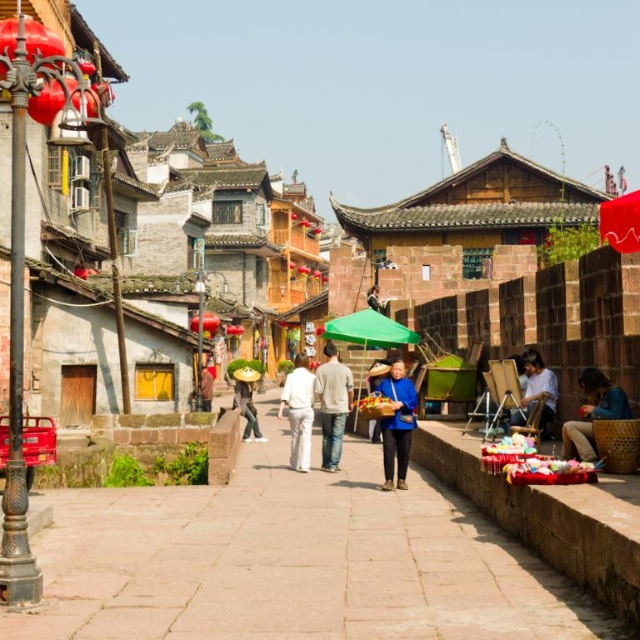
You are a tourist walking on the paved stone walkway at center and you see a brown leather jacket at center. Which object is longer?

The brown leather jacket at center is longer than the paved stone walkway at center.

You are a traveler walking down the street and see the green straw hat at center and the dark blue fabric at center. Which item is located to the left when viewed from your perspective?

The green straw hat at center is positioned on the left side of the dark blue fabric at center, so it is located to the left when viewed from your perspective.